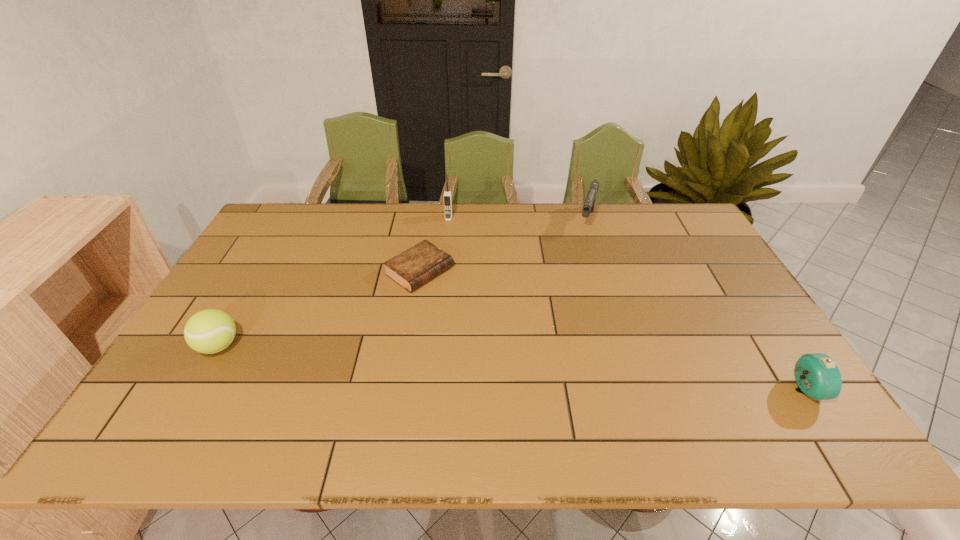
Where is `vacant space at the near right corner of the desktop`? The image size is (960, 540). vacant space at the near right corner of the desktop is located at coordinates (748, 382).

In order to click on unoccupied area between the gun and the alarm clock in this screenshot , I will do `click(695, 305)`.

Where is `free area in between the third farthest object and the tennis ball`? The image size is (960, 540). free area in between the third farthest object and the tennis ball is located at coordinates (320, 309).

This screenshot has width=960, height=540. In order to click on free area in between the cellular telephone and the second nearest object in this screenshot , I will do `click(334, 282)`.

Image resolution: width=960 pixels, height=540 pixels. What are the coordinates of `vacant area that lies between the diary and the gun` in the screenshot? It's located at (503, 245).

Identify the location of free space between the alarm clock and the fourth farthest object. (511, 368).

Identify the location of unoccupied area between the diary and the alarm clock. point(612,331).

Find the location of `free space between the leftmost object and the third farthest object`. free space between the leftmost object and the third farthest object is located at coordinates (320, 309).

You are a GUI agent. You are given a task and a screenshot of the screen. Output one action in this format:
    pyautogui.click(x=<x>, y=<y>)
    Task: Click on the vacant region between the shortest object and the gun
    
    Given the screenshot: What is the action you would take?
    pyautogui.click(x=503, y=245)

Where is `empty space that is in between the diary and the cellular telephone`? The image size is (960, 540). empty space that is in between the diary and the cellular telephone is located at coordinates (434, 245).